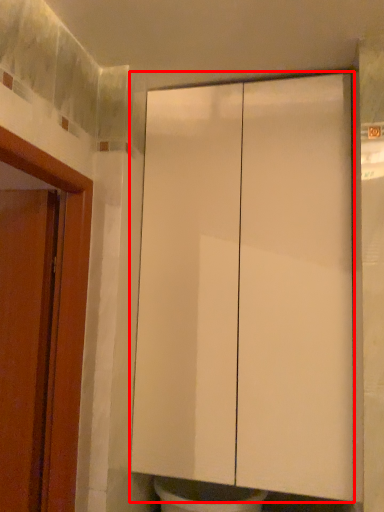
Question: From the image's perspective, what is the correct spatial relationship of cabinetry (annotated by the red box) in relation to door?

Choices:
 (A) above
 (B) below

Answer: (A)